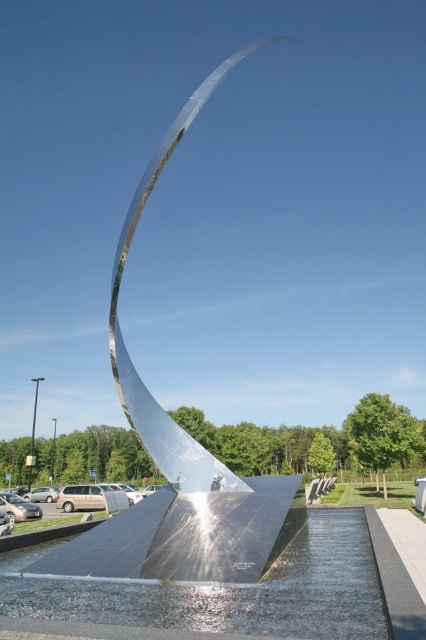
Is polished metallic sculpture at center further to the viewer compared to clear glass water at center?

That is True.

At what (x,y) coordinates should I click in order to perform the action: click on polished metallic sculpture at center. Please return your answer as a coordinate pair (x, y). Looking at the image, I should click on (175, 456).